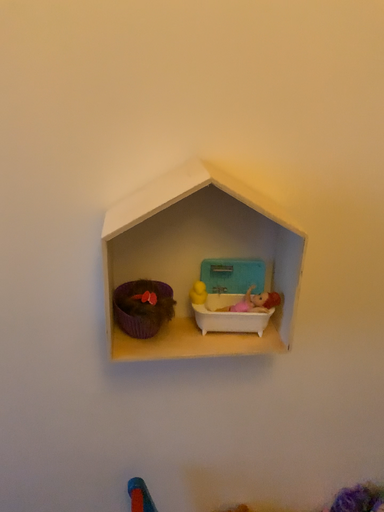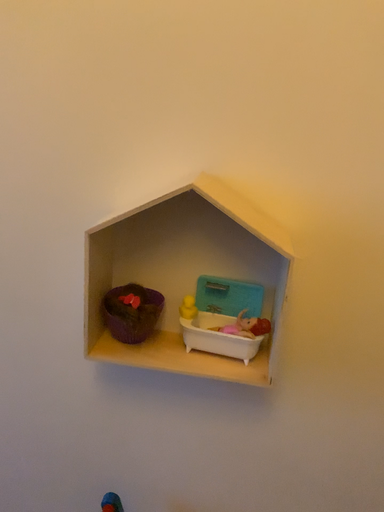
Question: How did the camera likely rotate when shooting the video?

Choices:
 (A) rotated downward
 (B) rotated upward

Answer: (B)